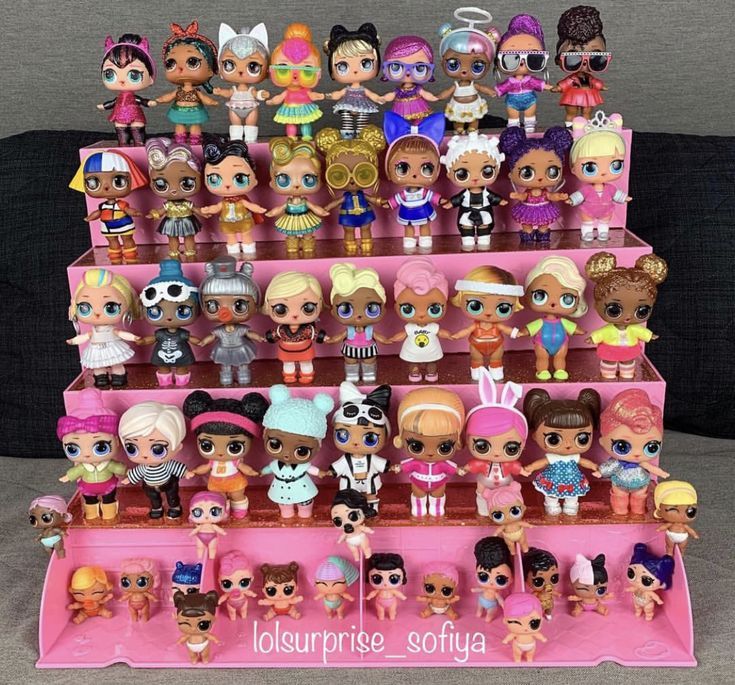
At what (x,y) coordinates should I click in order to perform the action: click on dolls in the top row. Please return your answer as a coordinate pair (x, y). This screenshot has width=735, height=685. Looking at the image, I should click on (126, 64), (193, 71), (234, 64), (290, 62), (354, 64), (401, 60), (473, 66), (523, 60), (591, 49).